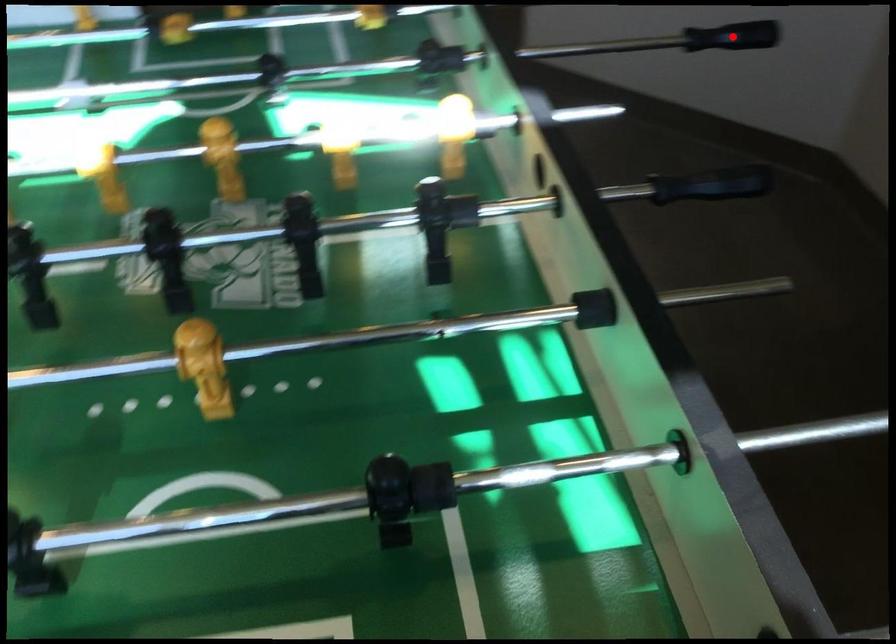
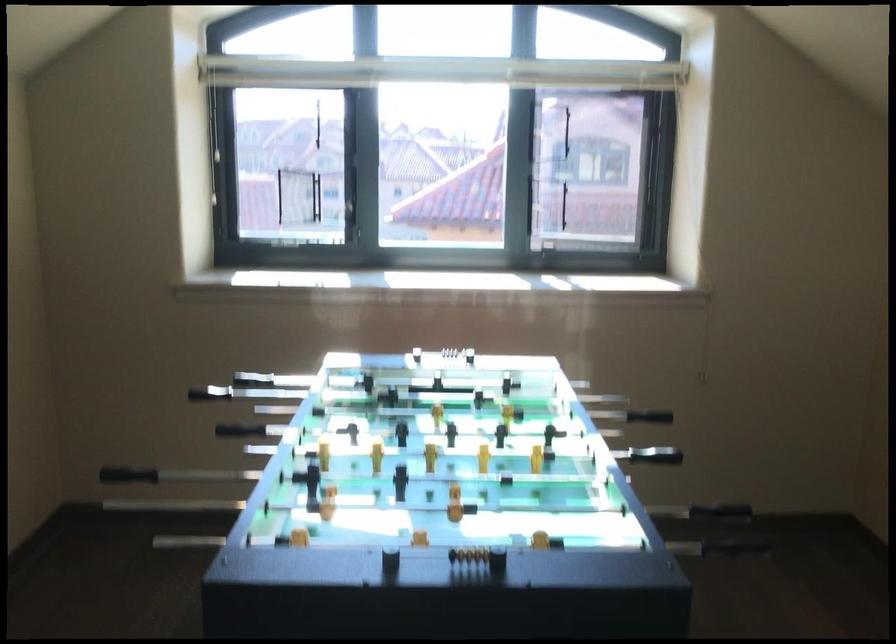
Find the pixel in the second image that matches the highlighted location in the first image.

(99, 494)